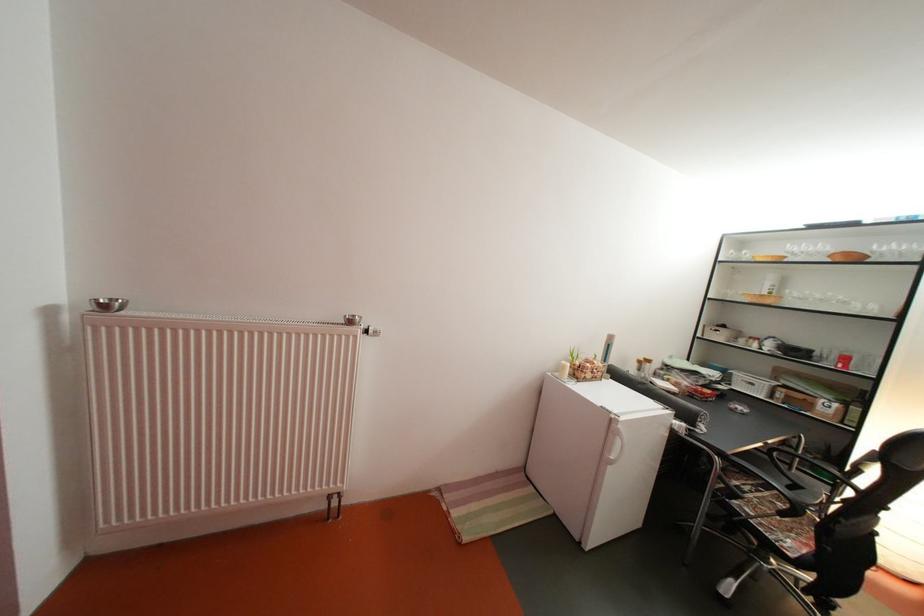
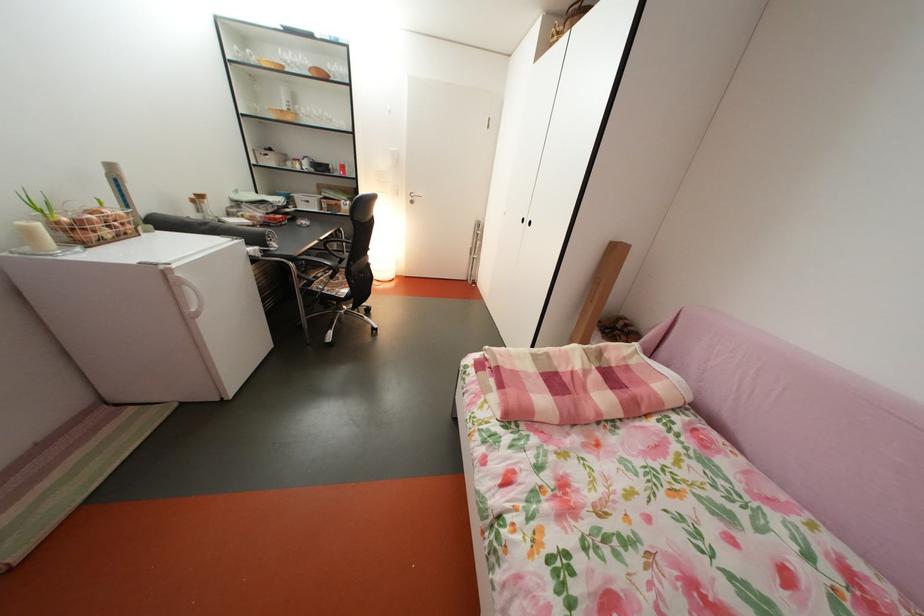
Where in the second image is the point corresponding to point 624,422 from the first image?

(174, 274)